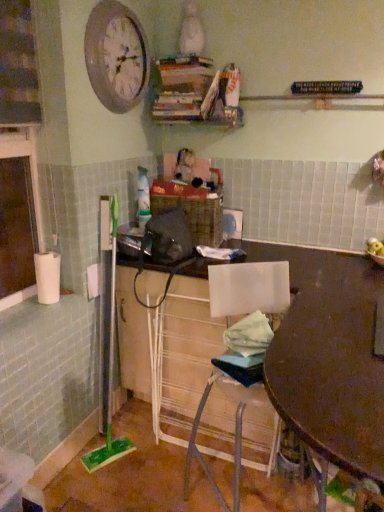
This screenshot has width=384, height=512. In order to click on vacant space positioned to the left of white plastic chair at lower center in this screenshot , I will do `click(132, 472)`.